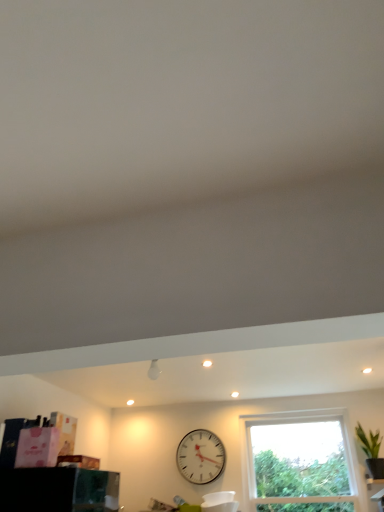
Question: Is matte white cabinet at lower right a part of green leafy plant at right?

Choices:
 (A) no
 (B) yes

Answer: (A)

Question: Does green leafy plant at right touch matte white cabinet at lower right?

Choices:
 (A) yes
 (B) no

Answer: (B)

Question: Is green leafy plant at right thinner than matte white cabinet at lower right?

Choices:
 (A) yes
 (B) no

Answer: (A)

Question: Is green leafy plant at right facing away from matte white cabinet at lower right?

Choices:
 (A) yes
 (B) no

Answer: (B)

Question: Does green leafy plant at right have a greater width compared to matte white cabinet at lower right?

Choices:
 (A) no
 (B) yes

Answer: (A)

Question: In the image, is green leafy plant at right on the left side or the right side of matte white cabinet at lower right?

Choices:
 (A) left
 (B) right

Answer: (A)

Question: From a real-world perspective, is green leafy plant at right above or below matte white cabinet at lower right?

Choices:
 (A) below
 (B) above

Answer: (B)

Question: Is green leafy plant at right wider or thinner than matte white cabinet at lower right?

Choices:
 (A) thin
 (B) wide

Answer: (A)

Question: In the image, is green leafy plant at right positioned in front of or behind matte white cabinet at lower right?

Choices:
 (A) front
 (B) behind

Answer: (B)

Question: From a real-world perspective, is transparent glass window at center physically located above or below green leafy plant at right?

Choices:
 (A) below
 (B) above

Answer: (A)

Question: Based on their sizes in the image, would you say transparent glass window at center is bigger or smaller than green leafy plant at right?

Choices:
 (A) small
 (B) big

Answer: (B)

Question: Considering the positions of transparent glass window at center and green leafy plant at right in the image, is transparent glass window at center wider or thinner than green leafy plant at right?

Choices:
 (A) wide
 (B) thin

Answer: (A)

Question: Is transparent glass window at center in front of or behind green leafy plant at right in the image?

Choices:
 (A) behind
 (B) front

Answer: (A)

Question: Is point (380, 502) positioned closer to the camera than point (370, 439)?

Choices:
 (A) closer
 (B) farther

Answer: (A)

Question: Considering their positions, is matte white cabinet at lower right located in front of or behind green leafy plant at right?

Choices:
 (A) front
 (B) behind

Answer: (A)